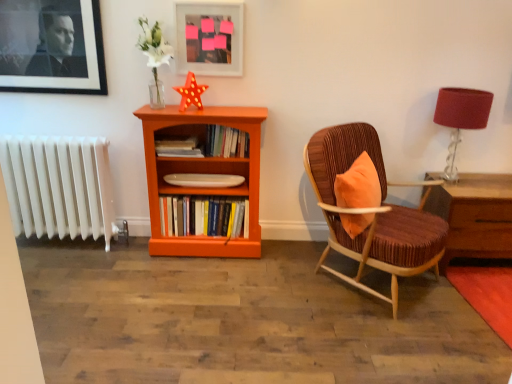
Question: Is velvet brown armchair at right positioned before hardcover books at center, which is the third book from bottom to top?

Choices:
 (A) no
 (B) yes

Answer: (B)

Question: Is there a large distance between velvet brown armchair at right and hardcover books at center, which is the third book from bottom to top?

Choices:
 (A) yes
 (B) no

Answer: (B)

Question: Is velvet brown armchair at right facing away from hardcover books at center, acting as the 1th book starting from the top?

Choices:
 (A) no
 (B) yes

Answer: (B)

Question: Considering the relative positions of velvet brown armchair at right and hardcover books at center, which is the third book from bottom to top, in the image provided, is velvet brown armchair at right to the left of hardcover books at center, which is the third book from bottom to top, from the viewer's perspective?

Choices:
 (A) yes
 (B) no

Answer: (B)

Question: From the image's perspective, is velvet brown armchair at right on hardcover books at center, which is the third book from bottom to top?

Choices:
 (A) yes
 (B) no

Answer: (B)

Question: Is velvet brown armchair at right further to the viewer compared to hardcover books at center, acting as the 1th book starting from the top?

Choices:
 (A) yes
 (B) no

Answer: (B)

Question: Does hardcover books at center, which is the third book from bottom to top, have a lesser width compared to white plastic radiator at left?

Choices:
 (A) yes
 (B) no

Answer: (A)

Question: Is hardcover books at center, acting as the 1th book starting from the top, positioned in front of white plastic radiator at left?

Choices:
 (A) no
 (B) yes

Answer: (B)

Question: Is hardcover books at center, which is the third book from bottom to top, positioned with its back to white plastic radiator at left?

Choices:
 (A) yes
 (B) no

Answer: (B)

Question: From a real-world perspective, does hardcover books at center, acting as the 1th book starting from the top, stand above white plastic radiator at left?

Choices:
 (A) no
 (B) yes

Answer: (B)

Question: Is there a large distance between hardcover books at center, which is the third book from bottom to top, and white plastic radiator at left?

Choices:
 (A) yes
 (B) no

Answer: (A)

Question: Is hardcover books at center, which is the third book from bottom to top, behind white plastic radiator at left?

Choices:
 (A) yes
 (B) no

Answer: (B)

Question: Is matte white picture frame at upper center, placed as the 2th picture frame when sorted from left to right, at the right side of hardcover books at center, which is the third book from bottom to top?

Choices:
 (A) yes
 (B) no

Answer: (B)